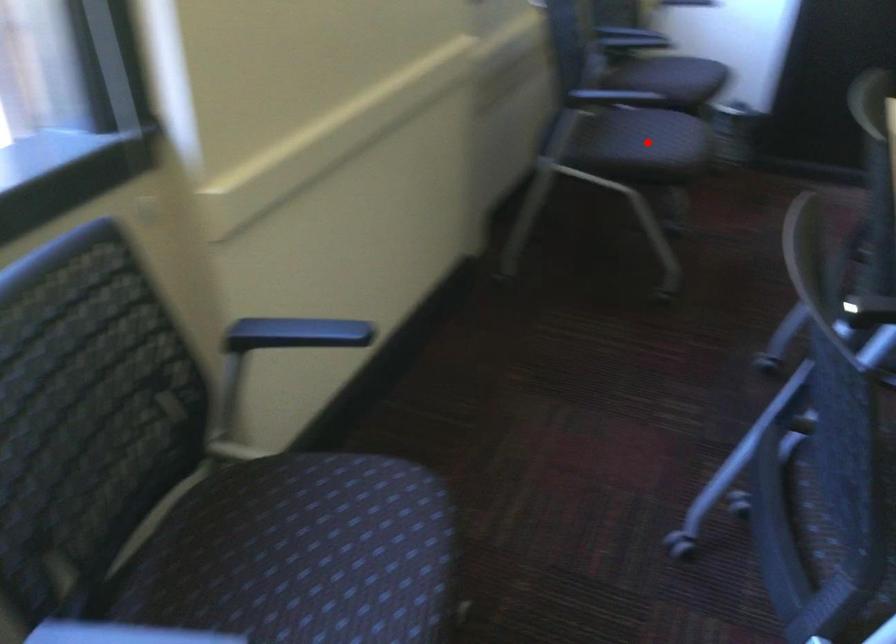
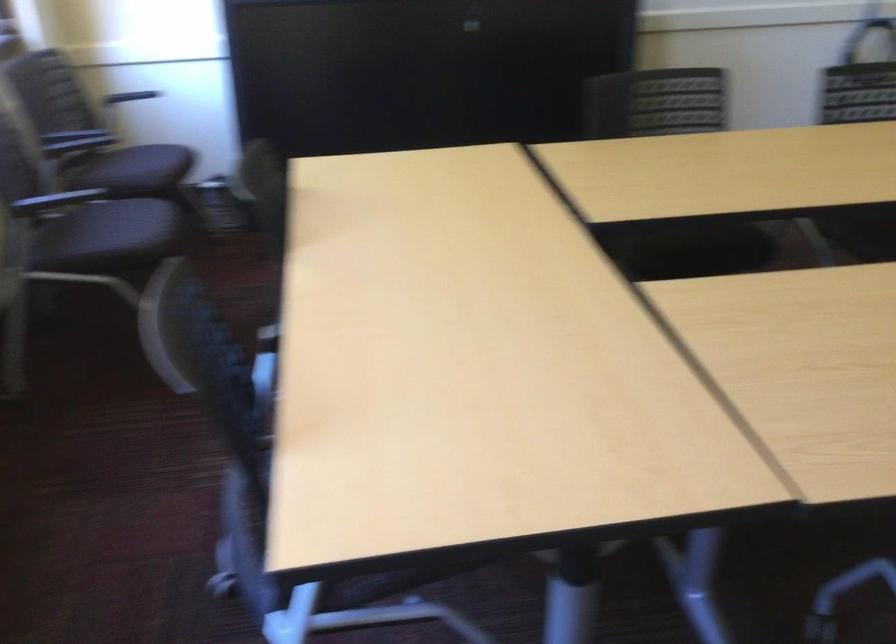
The point at the highlighted location is marked in the first image. Where is the corresponding point in the second image?

(116, 234)